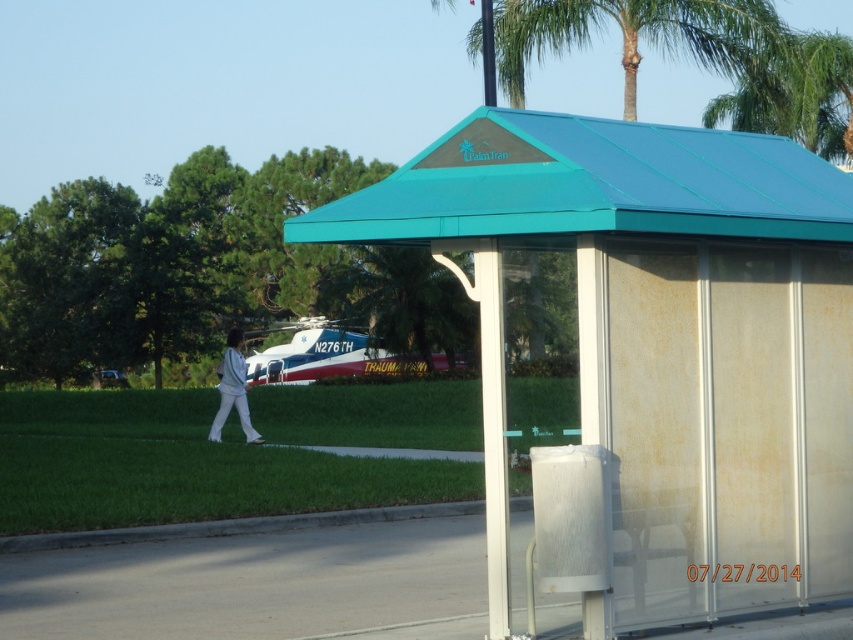
You are standing at the bus stop and want to know if the teal metal roof at upper center is blocking your view of the green leafy palm tree at upper center. Can you see the palm tree above the roof?

The teal metal roof at upper center is located below the green leafy palm tree at upper center, so yes, you can see the palm tree above the roof.